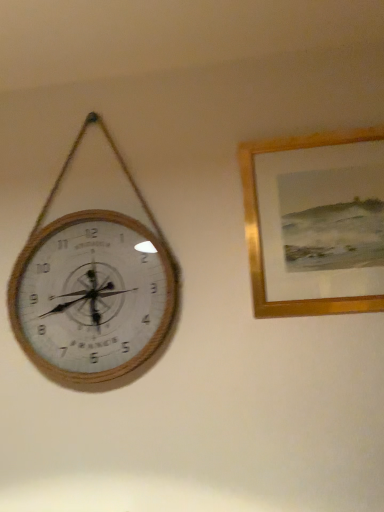
What do you see at coordinates (92, 289) in the screenshot? I see `wooden clock at left` at bounding box center [92, 289].

Where is `wooden clock at left`? This screenshot has width=384, height=512. wooden clock at left is located at coordinates (92, 289).

Measure the distance between point (371, 306) and camera.

Point (371, 306) is 4.54 feet from camera.

In order to face gold wooden picture frame at upper right, should I rotate leftwards or rightwards?

A 16.963 degree turn to the right will do.

Where is `gold wooden picture frame at upper right`? Image resolution: width=384 pixels, height=512 pixels. gold wooden picture frame at upper right is located at coordinates (260, 230).

Describe the element at coordinates (260, 230) in the screenshot. I see `gold wooden picture frame at upper right` at that location.

Locate an element on the screen. The height and width of the screenshot is (512, 384). wooden clock at left is located at coordinates (92, 289).

Can you confirm if wooden clock at left is positioned to the right of gold wooden picture frame at upper right?

In fact, wooden clock at left is to the left of gold wooden picture frame at upper right.

Does wooden clock at left come behind gold wooden picture frame at upper right?

Yes, it is behind gold wooden picture frame at upper right.

Considering the points (108, 348) and (332, 140), which point is behind, point (108, 348) or point (332, 140)?

The point (332, 140) is farther from the camera.

From the image's perspective, between wooden clock at left and gold wooden picture frame at upper right, which one is located above?

From the image's view, gold wooden picture frame at upper right is above.

From a real-world perspective, is wooden clock at left located beneath gold wooden picture frame at upper right?

Incorrect, from a real-world perspective, wooden clock at left is higher than gold wooden picture frame at upper right.

Considering the sizes of objects wooden clock at left and gold wooden picture frame at upper right in the image provided, who is thinner, wooden clock at left or gold wooden picture frame at upper right?

Thinner between the two is gold wooden picture frame at upper right.

Considering the sizes of wooden clock at left and gold wooden picture frame at upper right in the image, is wooden clock at left taller or shorter than gold wooden picture frame at upper right?

Considering their sizes, wooden clock at left has more height than gold wooden picture frame at upper right.

Who is bigger, wooden clock at left or gold wooden picture frame at upper right?

Bigger between the two is wooden clock at left.

Is wooden clock at left outside of gold wooden picture frame at upper right?

wooden clock at left is positioned outside gold wooden picture frame at upper right.

Are wooden clock at left and gold wooden picture frame at upper right making contact?

There is a gap between wooden clock at left and gold wooden picture frame at upper right.

Is wooden clock at left looking in the opposite direction of gold wooden picture frame at upper right?

wooden clock at left does not have its back to gold wooden picture frame at upper right.

What's the angular difference between wooden clock at left and gold wooden picture frame at upper right's facing directions?

There is a 0.00127-degree angle between the facing directions of wooden clock at left and gold wooden picture frame at upper right.

Locate an element on the screen. The width and height of the screenshot is (384, 512). picture frame in front of the wooden clock at left is located at coordinates (260, 230).

Between gold wooden picture frame at upper right and wooden clock at left, which one appears on the left side from the viewer's perspective?

Positioned to the left is wooden clock at left.

Does gold wooden picture frame at upper right come in front of wooden clock at left?

That is True.

Which is farther, (x=253, y=234) or (x=162, y=285)?

Positioned behind is point (x=253, y=234).

From the image's perspective, is gold wooden picture frame at upper right above wooden clock at left?

Yes, from the image's perspective, gold wooden picture frame at upper right is above wooden clock at left.

From a real-world perspective, which object stands above the other?

From a 3D spatial view, wooden clock at left is above.

Is gold wooden picture frame at upper right wider or thinner than wooden clock at left?

Clearly, gold wooden picture frame at upper right has less width compared to wooden clock at left.

Considering the sizes of gold wooden picture frame at upper right and wooden clock at left in the image, is gold wooden picture frame at upper right taller or shorter than wooden clock at left?

Considering their sizes, gold wooden picture frame at upper right has less height than wooden clock at left.

Which of these two, gold wooden picture frame at upper right or wooden clock at left, is bigger?

wooden clock at left is bigger.

Is gold wooden picture frame at upper right completely or partially outside of wooden clock at left?

That's correct, gold wooden picture frame at upper right is outside of wooden clock at left.

Would you consider gold wooden picture frame at upper right to be distant from wooden clock at left?

They are positioned close to each other.

Is gold wooden picture frame at upper right turned away from wooden clock at left?

No.

What's the angular difference between gold wooden picture frame at upper right and wooden clock at left's facing directions?

The angle between the facing direction of gold wooden picture frame at upper right and the facing direction of wooden clock at left is 0.00127 degrees.

Where is `wall clock behind the gold wooden picture frame at upper right`? This screenshot has height=512, width=384. wall clock behind the gold wooden picture frame at upper right is located at coordinates (92, 289).

Where is `picture frame below the wooden clock at left (from a real-world perspective)`? The image size is (384, 512). picture frame below the wooden clock at left (from a real-world perspective) is located at coordinates (260, 230).

At what (x,y) coordinates should I click in order to perform the action: click on wall clock that is behind the gold wooden picture frame at upper right. Please return your answer as a coordinate pair (x, y). This screenshot has height=512, width=384. Looking at the image, I should click on (92, 289).